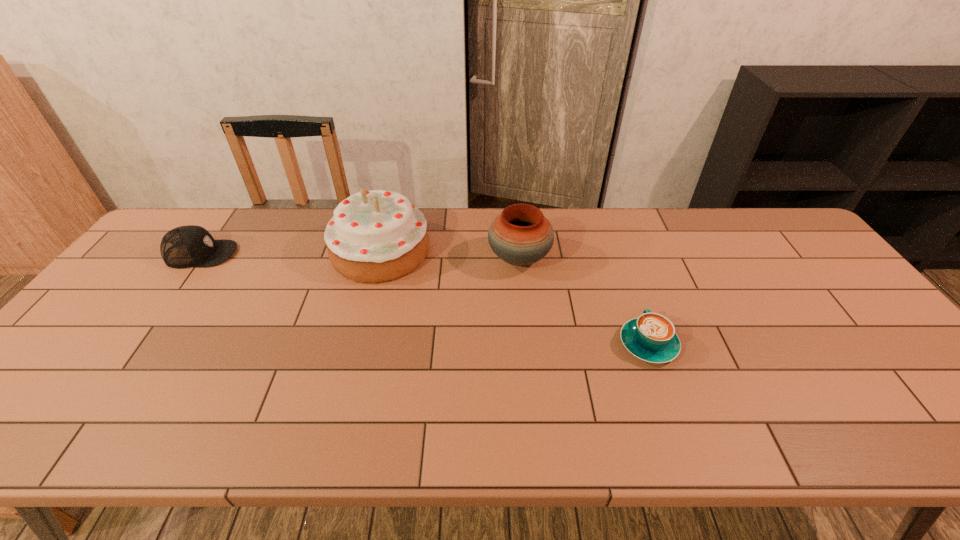
In the image, there is a desktop. At what (x,y) coordinates should I click in order to perform the action: click on vacant region at the near edge. Please return your answer as a coordinate pair (x, y). The image size is (960, 540). Looking at the image, I should click on (630, 426).

In the image, there is a desktop. Where is `vacant area at the right edge`? This screenshot has width=960, height=540. vacant area at the right edge is located at coordinates (843, 326).

In the image, there is a desktop. At what (x,y) coordinates should I click in order to perform the action: click on free space at the far left corner. Please return your answer as a coordinate pair (x, y). Looking at the image, I should click on (186, 211).

The image size is (960, 540). I want to click on free space at the near left corner of the desktop, so click(x=57, y=441).

Locate an element on the screen. free space at the near right corner of the desktop is located at coordinates (898, 413).

Where is `vacant space that is in between the tallest object and the second object from right to left`? The height and width of the screenshot is (540, 960). vacant space that is in between the tallest object and the second object from right to left is located at coordinates (450, 254).

This screenshot has height=540, width=960. What are the coordinates of `free space between the pottery and the cake` in the screenshot? It's located at (450, 254).

Locate an element on the screen. unoccupied area between the shortest object and the second object from left to right is located at coordinates (515, 298).

Find the location of `free space between the cake and the third shortest object`. free space between the cake and the third shortest object is located at coordinates (450, 254).

Locate an element on the screen. free area in between the nearest object and the cake is located at coordinates point(515,298).